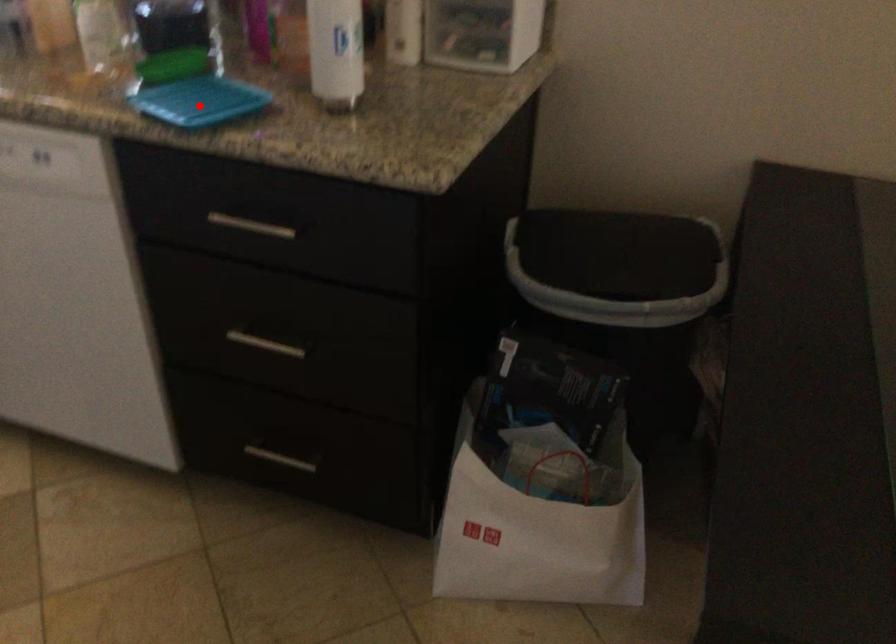
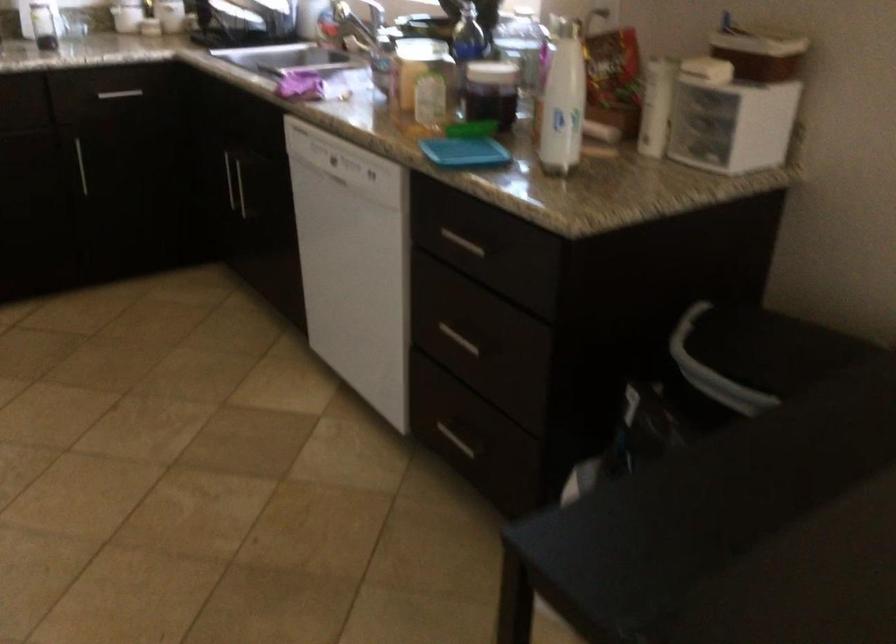
Question: I am providing you with two images of the same scene from different viewpoints. In image1, a red point is highlighted. Considering the same 3D point in image2, which of the following is correct?

Choices:
 (A) It is closer
 (B) It is farther

Answer: (B)